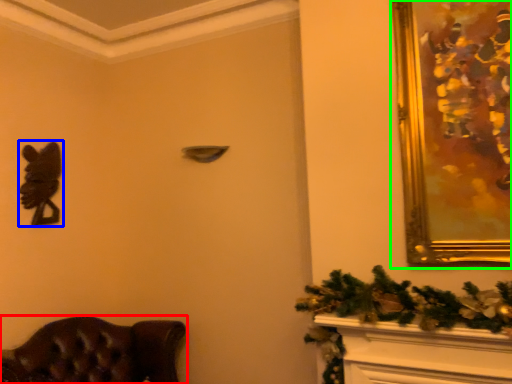
Question: Which object is the farthest from furniture (highlighted by a red box)? Choose among these: animal (highlighted by a blue box) or picture frame (highlighted by a green box).

Choices:
 (A) animal
 (B) picture frame

Answer: (B)